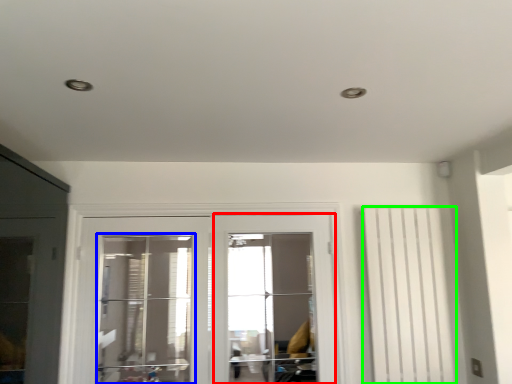
Question: Estimate the real-world distances between objects in this image. Which object is closer to screen door (highlighted by a red box), window (highlighted by a blue box) or curtain (highlighted by a green box)?

Choices:
 (A) window
 (B) curtain

Answer: (A)